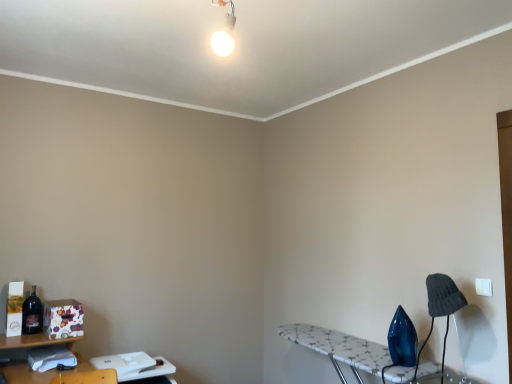
Question: Considering the relative positions of white plastic table at lower left, which is the 2th table from right to left, and dark gray fabric lampshade at lower right in the image provided, is white plastic table at lower left, which is the 2th table from right to left, in front of dark gray fabric lampshade at lower right?

Choices:
 (A) no
 (B) yes

Answer: (A)

Question: Does white plastic table at lower left, which is counted as the 1th table, starting from the left, have a lesser height compared to dark gray fabric lampshade at lower right?

Choices:
 (A) yes
 (B) no

Answer: (A)

Question: From a real-world perspective, is white plastic table at lower left, which is counted as the 1th table, starting from the left, physically above dark gray fabric lampshade at lower right?

Choices:
 (A) yes
 (B) no

Answer: (B)

Question: Can you confirm if white plastic table at lower left, which is the 2th table from right to left, is positioned to the right of dark gray fabric lampshade at lower right?

Choices:
 (A) no
 (B) yes

Answer: (A)

Question: Does white plastic table at lower left, which is the 2th table from right to left, have a greater width compared to dark gray fabric lampshade at lower right?

Choices:
 (A) yes
 (B) no

Answer: (A)

Question: From a real-world perspective, is white plastic table at lower left, which is counted as the 1th table, starting from the left, below dark gray fabric lampshade at lower right?

Choices:
 (A) no
 (B) yes

Answer: (B)

Question: Can you confirm if dark gray fabric lampshade at lower right is positioned to the right of white glossy bulb at upper center?

Choices:
 (A) yes
 (B) no

Answer: (A)

Question: Does dark gray fabric lampshade at lower right have a greater height compared to white glossy bulb at upper center?

Choices:
 (A) yes
 (B) no

Answer: (A)

Question: Is dark gray fabric lampshade at lower right positioned with its back to white glossy bulb at upper center?

Choices:
 (A) no
 (B) yes

Answer: (A)

Question: From the image's perspective, is dark gray fabric lampshade at lower right above white glossy bulb at upper center?

Choices:
 (A) no
 (B) yes

Answer: (A)

Question: From the image's perspective, is dark gray fabric lampshade at lower right located beneath white glossy bulb at upper center?

Choices:
 (A) yes
 (B) no

Answer: (A)

Question: Is white glossy bulb at upper center surrounded by dark gray fabric lampshade at lower right?

Choices:
 (A) yes
 (B) no

Answer: (B)

Question: Is matte dark blue bottle at left at the right side of white plastic table at lower left, which is the 2th table from right to left?

Choices:
 (A) yes
 (B) no

Answer: (B)